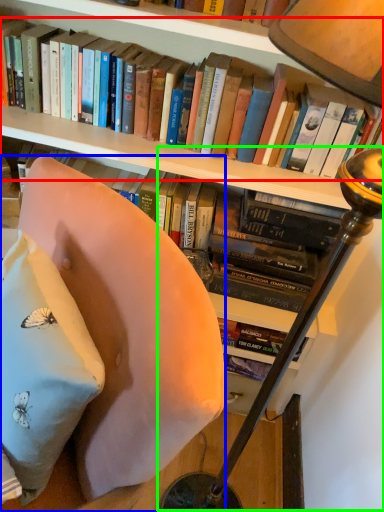
Question: Considering the real-world distances, which object is farthest from book (highlighted by a red box)? chair (highlighted by a blue box) or table lamp (highlighted by a green box)?

Choices:
 (A) chair
 (B) table lamp

Answer: (A)